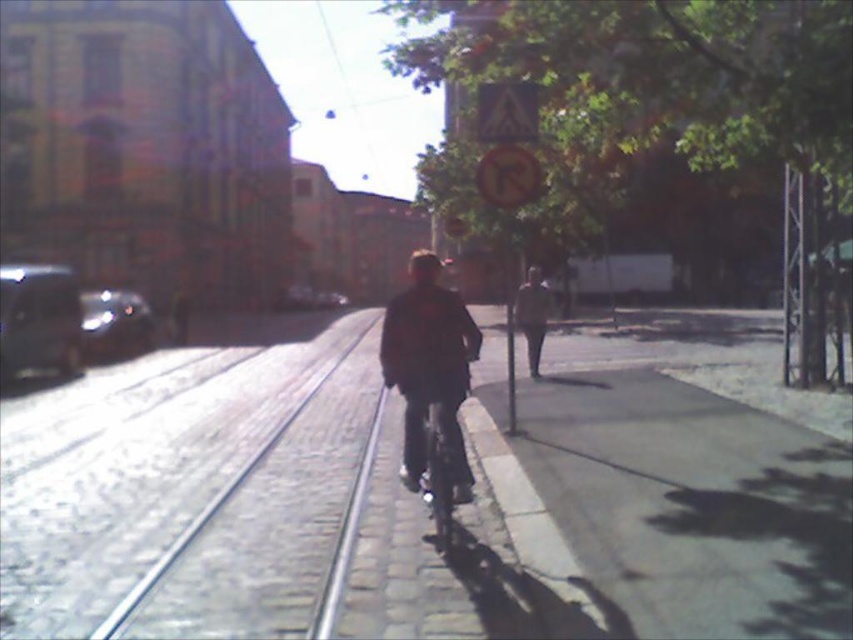
Question: Can you confirm if gray concrete train track at left is wider than dark brown leather jacket at center?

Choices:
 (A) yes
 (B) no

Answer: (B)

Question: Can you confirm if dark red jacket at center is wider than dark brown leather jacket at center?

Choices:
 (A) no
 (B) yes

Answer: (B)

Question: Which object appears closest to the camera in this image?

Choices:
 (A) shiny metallic bicycle at center
 (B) gray concrete train track at left
 (C) gray concrete sidewalk at center

Answer: (B)

Question: Which point appears closest to the camera in this image?

Choices:
 (A) (442, 444)
 (B) (786, 566)
 (C) (541, 310)

Answer: (B)

Question: Is dark red jacket at center to the right of shiny metallic bicycle at center from the viewer's perspective?

Choices:
 (A) yes
 (B) no

Answer: (B)

Question: Which object is the closest to the dark brown leather jacket at center?

Choices:
 (A) gray concrete sidewalk at center
 (B) gray concrete train track at left
 (C) shiny metallic bicycle at center
 (D) dark red jacket at center

Answer: (D)